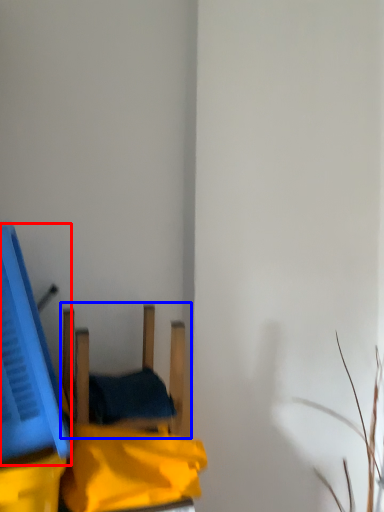
Question: Which point is further to the camera, wide (highlighted by a red box) or furniture (highlighted by a blue box)?

Choices:
 (A) wide
 (B) furniture

Answer: (B)